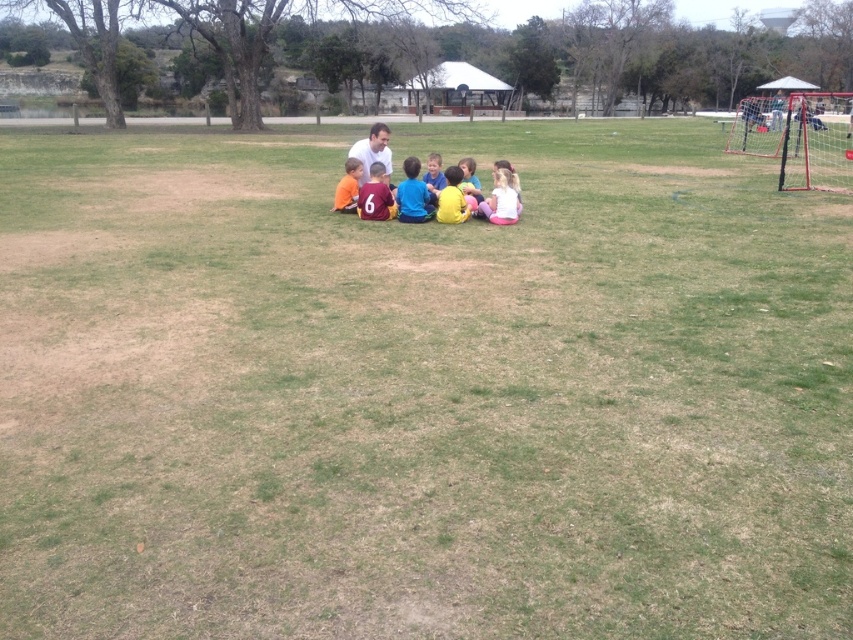
Between point (447, 184) and point (460, 164), which one is positioned behind?

The point (460, 164) is more distant.

Looking at this image, which is above, yellow matte shirt at center or matte pink shirt at center?

matte pink shirt at center is above.

Between point (445, 221) and point (467, 177), which one is positioned behind?

Point (467, 177)

Locate an element on the screen. The height and width of the screenshot is (640, 853). yellow matte shirt at center is located at coordinates (451, 198).

Does matte blue shirt at center appear on the right side of yellow matte shirt at center?

No, matte blue shirt at center is not to the right of yellow matte shirt at center.

Is point (421, 202) in front of point (457, 220)?

No, (421, 202) is behind (457, 220).

Between point (409, 193) and point (440, 196), which one is positioned behind?

Point (409, 193)

At what (x,y) coordinates should I click in order to perform the action: click on matte blue shirt at center. Please return your answer as a coordinate pair (x, y). This screenshot has height=640, width=853. Looking at the image, I should click on (413, 195).

Can you confirm if white matte shirt at center is smaller than blue fabric shirt at center?

No, white matte shirt at center is not smaller than blue fabric shirt at center.

Measure the distance between point (503, 209) and camera.

A distance of 10.89 meters exists between point (503, 209) and camera.

Identify the location of white matte shirt at center. The image size is (853, 640). (502, 198).